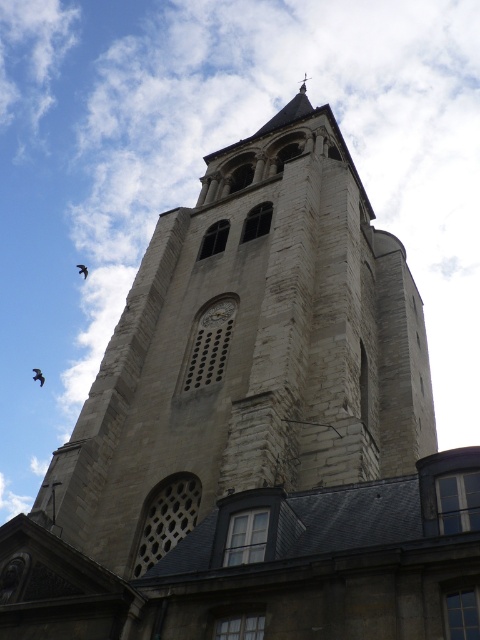
You are a birdwatcher observing the birds on the tower. You see a black feathered bird at upper left and a brown feathered bird at upper left. Which bird is located more to the left side?

The black feathered bird at upper left is positioned on the left side of brown feathered bird at upper left, so the black feathered bird at upper left is more to the left.

From the picture: You are standing in front of the historic stone tower and notice two birds perched on the arched openings at the top. Which bird is closer to you, the black feathered bird at upper left or the brown feathered bird at upper left?

The black feathered bird at upper left is closer to you because the brown feathered bird at upper left is positioned behind it.

You are a birdwatcher observing the tower and notice two birds perched on the arched openings at the top of the tower. One is a black feathered bird at upper left and the other is a brown feathered bird at upper left. Which bird has a greater height?

The black feathered bird at upper left is taller than the brown feathered bird at upper left.